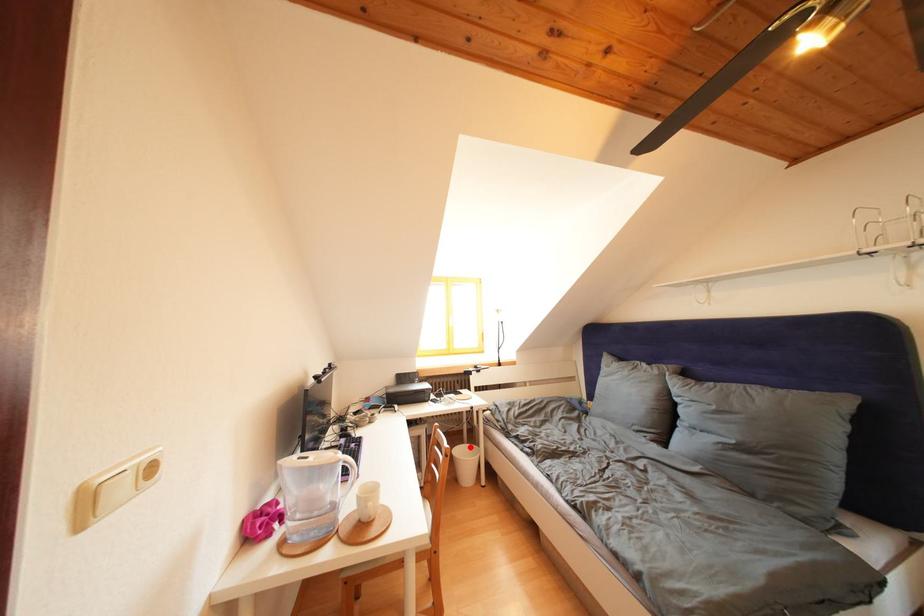
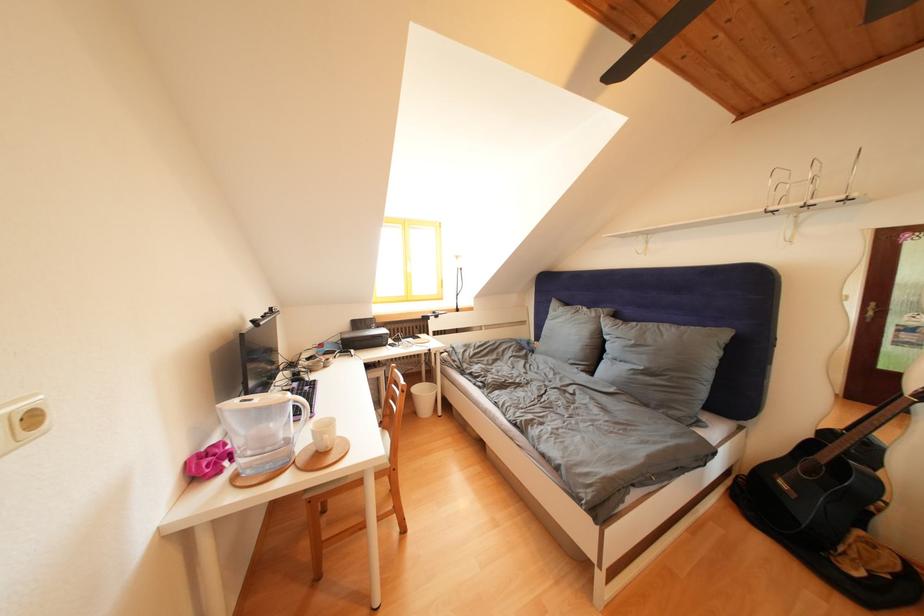
Question: I am providing you with two images of the same scene from different viewpoints. In image1, a red point is highlighted. Considering the same 3D point in image2, which of the following is correct?

Choices:
 (A) It is closer
 (B) It is farther

Answer: (A)